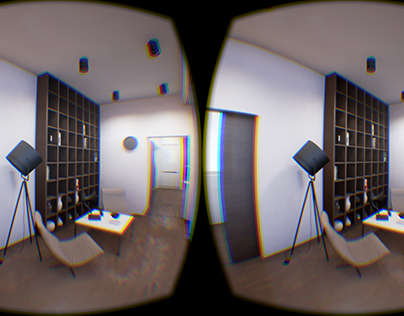
This screenshot has height=316, width=404. Identify the location of lights. (153, 50), (370, 62), (165, 84), (116, 90), (86, 62).